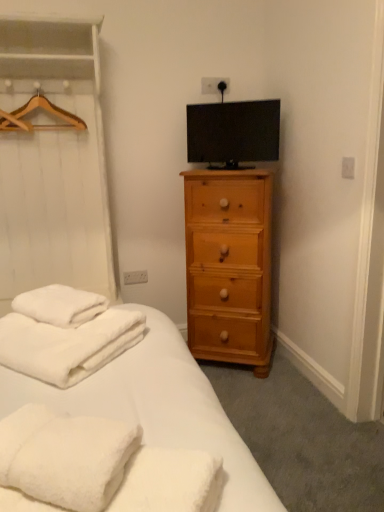
Question: Are light brown wood chest of drawers at right and matte black tv at upper center making contact?

Choices:
 (A) no
 (B) yes

Answer: (A)

Question: From a real-world perspective, is light brown wood chest of drawers at right positioned over matte black tv at upper center based on gravity?

Choices:
 (A) no
 (B) yes

Answer: (A)

Question: Does light brown wood chest of drawers at right appear on the right side of matte black tv at upper center?

Choices:
 (A) no
 (B) yes

Answer: (B)

Question: Is light brown wood chest of drawers at right not within matte black tv at upper center?

Choices:
 (A) yes
 (B) no

Answer: (A)

Question: Can you confirm if light brown wood chest of drawers at right is positioned to the left of matte black tv at upper center?

Choices:
 (A) yes
 (B) no

Answer: (B)

Question: From the image's perspective, is white fluffy towels at lower left located above or below light brown wood chest of drawers at right?

Choices:
 (A) below
 (B) above

Answer: (A)

Question: In the image, is white fluffy towels at lower left positioned in front of or behind light brown wood chest of drawers at right?

Choices:
 (A) front
 (B) behind

Answer: (A)

Question: In terms of height, does white fluffy towels at lower left look taller or shorter compared to light brown wood chest of drawers at right?

Choices:
 (A) short
 (B) tall

Answer: (A)

Question: In terms of size, does white fluffy towels at lower left appear bigger or smaller than light brown wood chest of drawers at right?

Choices:
 (A) small
 (B) big

Answer: (A)

Question: Would you say matte black tv at upper center is to the left or to the right of white fluffy towels at lower left in the picture?

Choices:
 (A) left
 (B) right

Answer: (B)

Question: Considering the positions of point (228, 133) and point (67, 362), is point (228, 133) closer or farther from the camera than point (67, 362)?

Choices:
 (A) farther
 (B) closer

Answer: (A)

Question: From the image's perspective, is matte black tv at upper center located above or below white fluffy towels at lower left?

Choices:
 (A) below
 (B) above

Answer: (B)

Question: In the image, is matte black tv at upper center positioned in front of or behind white fluffy towels at lower left?

Choices:
 (A) front
 (B) behind

Answer: (B)

Question: Do you think light brown wood chest of drawers at right is within white fluffy towels at lower left, or outside of it?

Choices:
 (A) outside
 (B) inside

Answer: (A)

Question: In terms of size, does light brown wood chest of drawers at right appear bigger or smaller than white fluffy towels at lower left?

Choices:
 (A) small
 (B) big

Answer: (B)